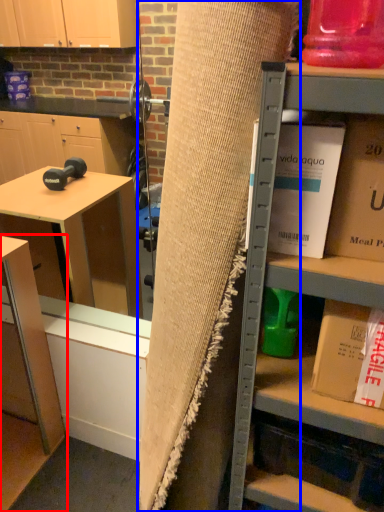
Question: Which object is closer to the camera taking this photo, table (highlighted by a red box) or curtain (highlighted by a blue box)?

Choices:
 (A) table
 (B) curtain

Answer: (B)